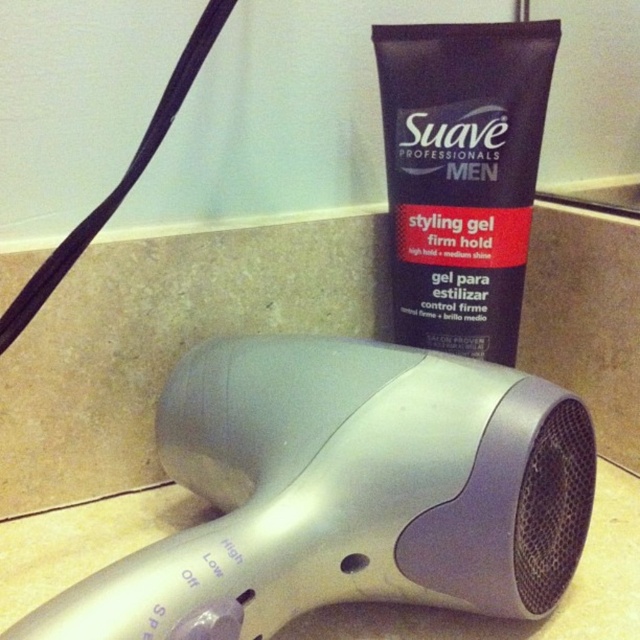
You are a GUI agent. You are given a task and a screenshot of the screen. Output one action in this format:
    pyautogui.click(x=<x>, y=<y>)
    Task: Click on the silver plastic hair dryer at lower center
    Image resolution: width=640 pixels, height=640 pixels.
    Given the screenshot: What is the action you would take?
    pyautogui.click(x=346, y=492)